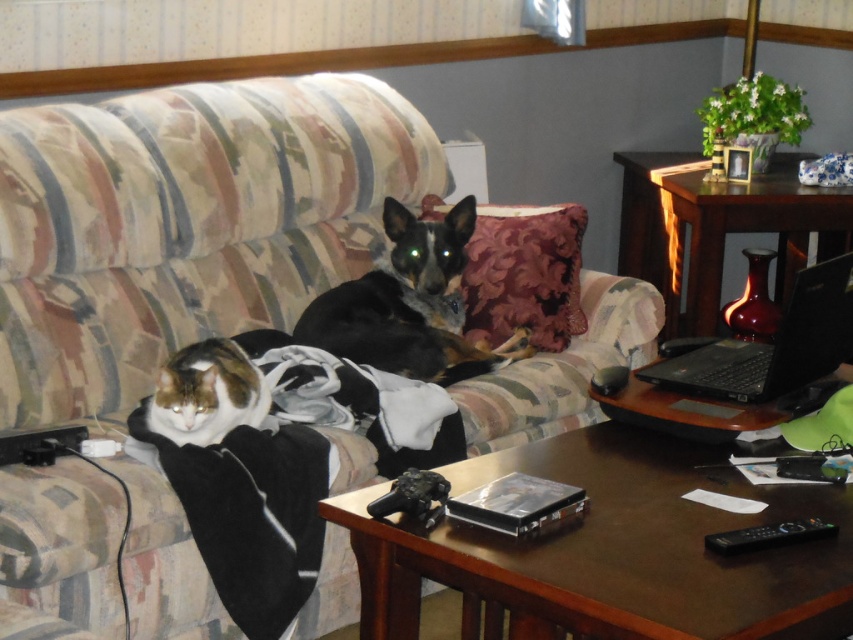
You are a photographer setting up a tripod to take a portrait of the fluffy white cat at lower left. The tripod has a maximum height adjustment of 1 meter. Considering the height of the striped fabric couch at center, will the tripod need to be raised to its maximum height to capture the cat at eye level?

The striped fabric couch at center has a greater height compared to the fluffy white cat at lower left. Since the couch is taller than the cat, the tripod may not need to be raised to its maximum height to reach the cat at eye level. The exact adjustment depends on the couch height, but the cat is lower than the couch, so the tripod can be set lower than maximum.

You are arranging a small plant on the wooden table at lower center. To ensure it is visible from the living room entrance, should you place it in front of or behind the striped fabric couch at center?

The wooden table at lower center is behind the striped fabric couch at center, so placing the plant on the table would position it behind the couch. To make the plant visible from the entrance, you should place it in front of the striped fabric couch at center instead of behind it.

You are trying to place a new throw pillow between the black plastic laptop at right and the fluffy white cat at lower left on the couch. Based on their positions, which object is higher up on the couch, allowing the pillow to be placed between them?

The black plastic laptop at right is located above the fluffy white cat at lower left, so placing the pillow between them would require positioning it below the laptop and above the cat.